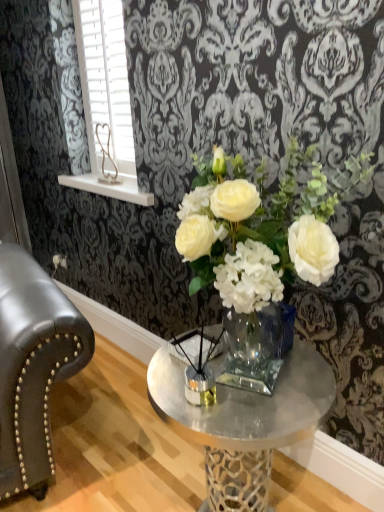
Question: Is white plastic blinds at upper left wider or thinner than clear glass vase at center?

Choices:
 (A) thin
 (B) wide

Answer: (A)

Question: Is white plastic blinds at upper left inside the boundaries of clear glass vase at center, or outside?

Choices:
 (A) inside
 (B) outside

Answer: (B)

Question: From the image's perspective, is white plastic blinds at upper left located above or below clear glass vase at center?

Choices:
 (A) above
 (B) below

Answer: (A)

Question: In the image, is clear glass vase at center on the left side or the right side of white plastic blinds at upper left?

Choices:
 (A) right
 (B) left

Answer: (A)

Question: From the image's perspective, is clear glass vase at center above or below white plastic blinds at upper left?

Choices:
 (A) above
 (B) below

Answer: (B)

Question: Is point (286, 386) positioned closer to the camera than point (132, 133)?

Choices:
 (A) farther
 (B) closer

Answer: (B)

Question: From a real-world perspective, is clear glass vase at center above or below white plastic blinds at upper left?

Choices:
 (A) below
 (B) above

Answer: (A)